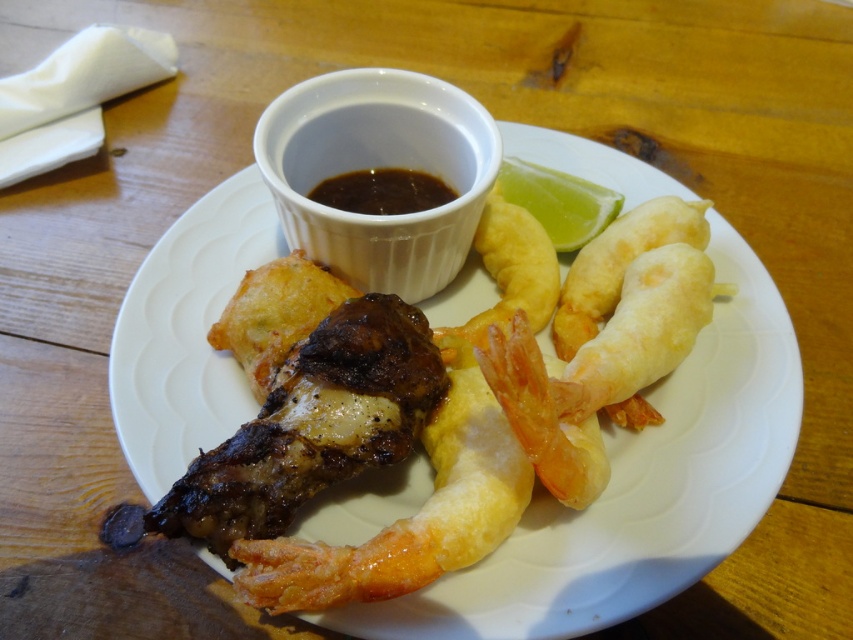
Question: Among these points, which one is farthest from the camera?

Choices:
 (A) (315, 576)
 (B) (349, 205)

Answer: (B)

Question: Which object appears farthest from the camera in this image?

Choices:
 (A) golden fried shrimp at center
 (B) dark glossy sauce at center

Answer: (B)

Question: Is golden fried shrimp at center positioned in front of dark glossy sauce at center?

Choices:
 (A) yes
 (B) no

Answer: (A)

Question: Observing the image, what is the correct spatial positioning of golden fried shrimp at center in reference to dark glossy sauce at center?

Choices:
 (A) left
 (B) right

Answer: (B)

Question: Does golden fried shrimp at center have a lesser width compared to dark glossy sauce at center?

Choices:
 (A) yes
 (B) no

Answer: (B)